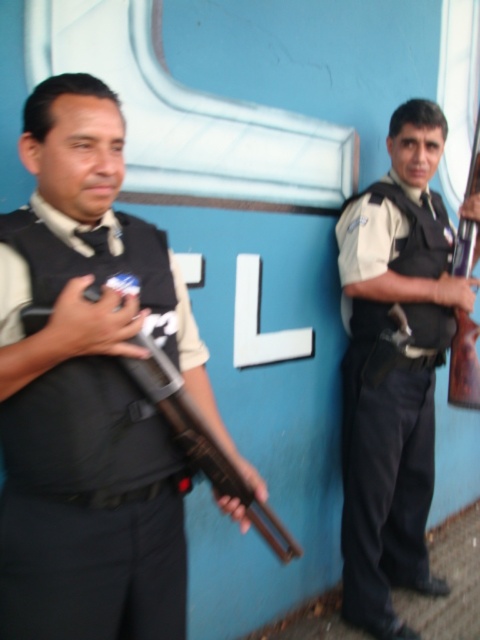
Does point (146, 532) come closer to viewer compared to point (472, 396)?

Yes, it is in front of point (472, 396).

Based on the photo, is matte black rifle at left further to the viewer compared to wooden rifle at right?

No, it is in front of wooden rifle at right.

Where is `matte black rifle at left`? Image resolution: width=480 pixels, height=640 pixels. matte black rifle at left is located at coordinates (90, 392).

Is matte black vest at center thinner than wooden rifle at right?

No, matte black vest at center is not thinner than wooden rifle at right.

Does matte black vest at center have a larger size compared to wooden rifle at right?

Correct, matte black vest at center is larger in size than wooden rifle at right.

Who is more distant from viewer, (412, 433) or (460, 369)?

The point (412, 433) is more distant.

Identify the location of matte black vest at center. This screenshot has height=640, width=480. (394, 369).

Measure the distance between point (377, 573) and camera.

2.11 meters

Is matte black vest at center to the left of matte black shotgun at left from the viewer's perspective?

No, matte black vest at center is not to the left of matte black shotgun at left.

Does point (373, 236) come closer to viewer compared to point (151, 396)?

No, (373, 236) is behind (151, 396).

The height and width of the screenshot is (640, 480). Identify the location of matte black vest at center. (394, 369).